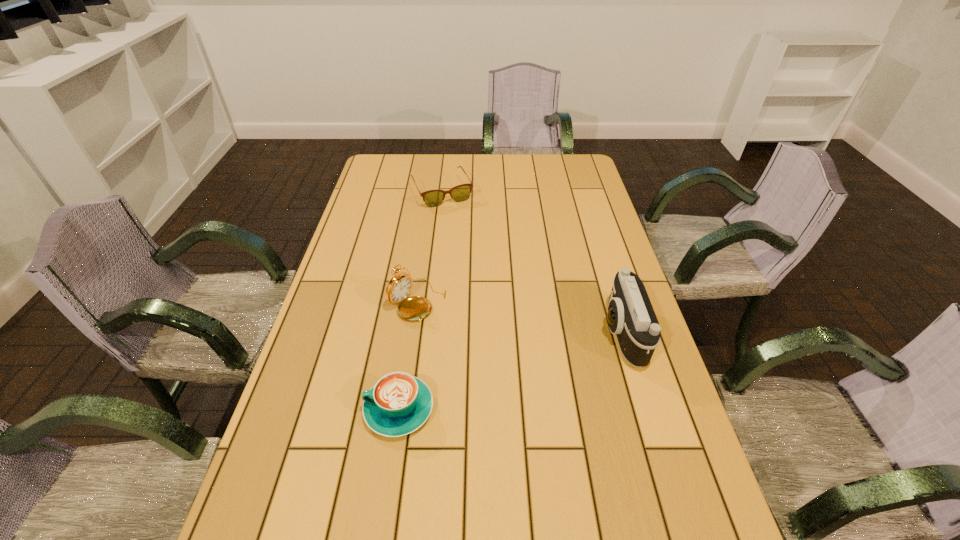
In the image, there is a desktop. Where is `vacant space at the right edge`? This screenshot has width=960, height=540. vacant space at the right edge is located at coordinates (660, 410).

Find the location of a particular element. This screenshot has height=540, width=960. vacant space at the far right corner of the desktop is located at coordinates (564, 164).

The image size is (960, 540). In order to click on free space at the near right corner of the desktop in this screenshot , I will do `click(704, 504)`.

Find the location of a particular element. empty space that is in between the pocket watch and the rightmost object is located at coordinates (520, 316).

You are a GUI agent. You are given a task and a screenshot of the screen. Output one action in this format:
    pyautogui.click(x=<x>, y=<y>)
    Task: Click on the free space between the nearest object and the pocket watch
    The image size is (960, 540).
    Given the screenshot: What is the action you would take?
    pyautogui.click(x=408, y=355)

Where is `empty space between the farthest object and the pocket watch`? The image size is (960, 540). empty space between the farthest object and the pocket watch is located at coordinates pyautogui.click(x=430, y=246).

This screenshot has width=960, height=540. Find the location of `free space between the farthest object and the camera`. free space between the farthest object and the camera is located at coordinates (532, 262).

Identify the location of unoccupied area between the spectacles and the rightmost object. The image size is (960, 540). (532, 262).

Identify the location of unoccupied position between the rightmost object and the nearest object. Image resolution: width=960 pixels, height=540 pixels. (511, 370).

The image size is (960, 540). Find the location of `vacant space in between the cappuccino and the camera`. vacant space in between the cappuccino and the camera is located at coordinates (511, 370).